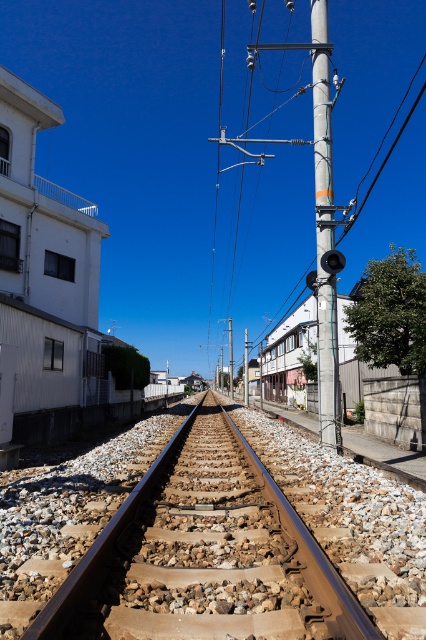
You are a maintenance worker inspecting the railway tracks. You notice two poles along the tracks. Which pole is closer to the left side of the tracks? Please refer to the silver metallic pole at center and the smooth metallic pole at upper center in your answer.

The silver metallic pole at center is closer to the left side of the tracks because it is positioned to the left of the smooth metallic pole at upper center.